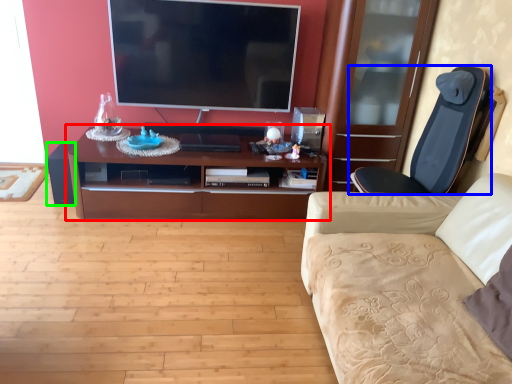
Question: Based on their relative distances, which object is nearer to cabinetry (highlighted by a red box)? Choose from chair (highlighted by a blue box) and speaker (highlighted by a green box).

Choices:
 (A) chair
 (B) speaker

Answer: (B)